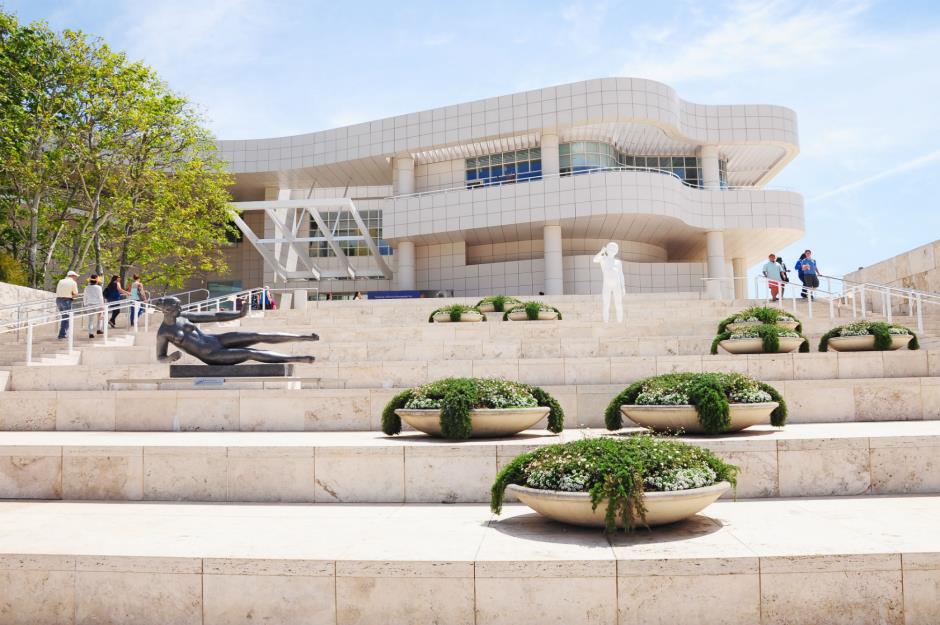
At what (x,y) coordinates should I click in order to perform the action: click on large saucer shaped planter on second step. Please return your answer as a coordinate pair (x, y). Looking at the image, I should click on (545, 499), (677, 502).